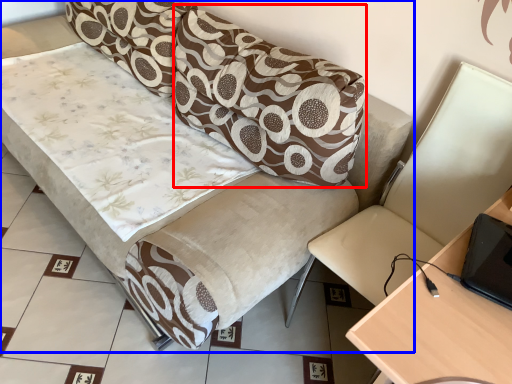
Question: Which point is further to the camera, pillow (highlighted by a red box) or studio couch (highlighted by a blue box)?

Choices:
 (A) pillow
 (B) studio couch

Answer: (A)